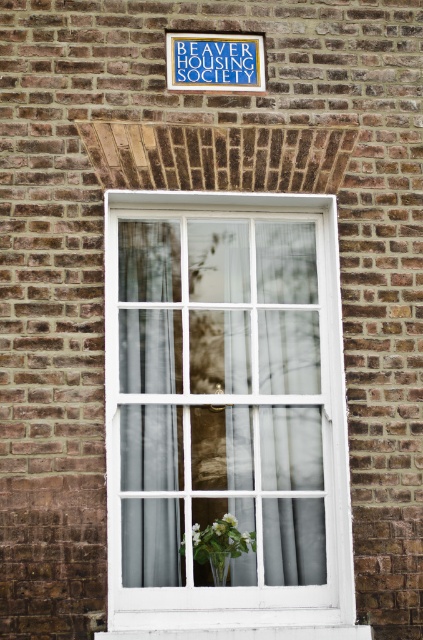
You are an interior designer assessing the space in front of the white painted wood window at center and the green leafy plant at center. Which object occupies more horizontal space in the scene?

The white painted wood window at center has a greater width than the green leafy plant at center, so it occupies more horizontal space in the scene.

You are standing in front of the brick building and notice the white sheer curtain at center and the translucent glass vase at lower center. From your perspective, which object is positioned to the right?

The translucent glass vase at lower center is positioned to the right of the white sheer curtain at center.